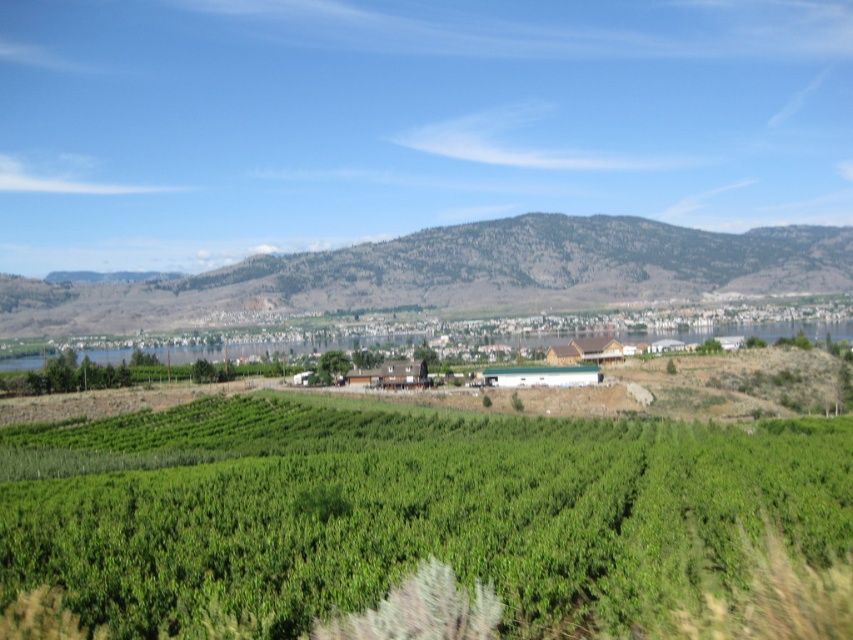
Question: Which point appears closest to the camera in this image?

Choices:
 (A) (51, 294)
 (B) (677, 556)

Answer: (B)

Question: Is green leafy vineyard at center to the left of rocky gray mountain at center from the viewer's perspective?

Choices:
 (A) yes
 (B) no

Answer: (A)

Question: Can you confirm if green leafy vineyard at center is thinner than rocky gray mountain at center?

Choices:
 (A) no
 (B) yes

Answer: (B)

Question: Is the position of green leafy vineyard at center more distant than that of rocky gray mountain at center?

Choices:
 (A) yes
 (B) no

Answer: (B)